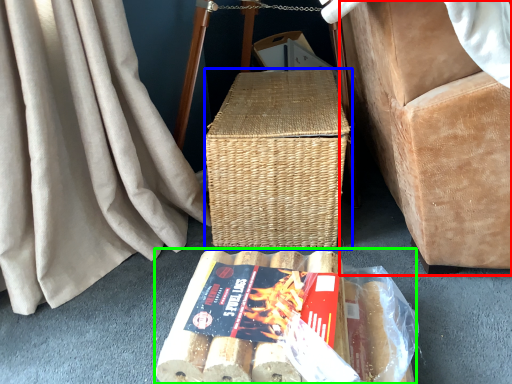
Question: Based on their relative distances, which object is farther from furniture (highlighted by a red box)? Choose from picnic basket (highlighted by a blue box) and food (highlighted by a green box).

Choices:
 (A) picnic basket
 (B) food

Answer: (B)